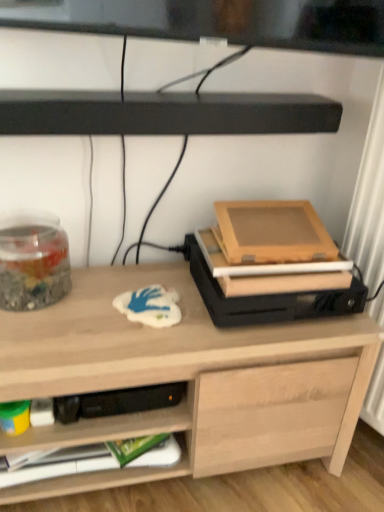
Question: Does light wood desk at center have a lesser width compared to black matte soundbar at upper center?

Choices:
 (A) no
 (B) yes

Answer: (A)

Question: Can you confirm if light wood desk at center is shorter than black matte soundbar at upper center?

Choices:
 (A) yes
 (B) no

Answer: (B)

Question: From a real-world perspective, is light wood desk at center beneath black matte soundbar at upper center?

Choices:
 (A) yes
 (B) no

Answer: (A)

Question: Is light wood desk at center at the left side of black matte soundbar at upper center?

Choices:
 (A) no
 (B) yes

Answer: (B)

Question: Considering the relative sizes of light wood desk at center and black matte soundbar at upper center in the image provided, is light wood desk at center smaller than black matte soundbar at upper center?

Choices:
 (A) no
 (B) yes

Answer: (A)

Question: From a real-world perspective, is transparent glass jar at left physically located above or below green matte paperback book at lower left?

Choices:
 (A) above
 (B) below

Answer: (A)

Question: In the image, is transparent glass jar at left on the left side or the right side of green matte paperback book at lower left?

Choices:
 (A) left
 (B) right

Answer: (A)

Question: From their relative heights in the image, would you say transparent glass jar at left is taller or shorter than green matte paperback book at lower left?

Choices:
 (A) short
 (B) tall

Answer: (B)

Question: Is transparent glass jar at left inside or outside of green matte paperback book at lower left?

Choices:
 (A) outside
 (B) inside

Answer: (A)

Question: In the image, is transparent glass jar at left positioned in front of or behind black matte soundbar at upper center?

Choices:
 (A) front
 (B) behind

Answer: (B)

Question: Based on their positions, is transparent glass jar at left located to the left or right of black matte soundbar at upper center?

Choices:
 (A) left
 (B) right

Answer: (A)

Question: From the image's perspective, is transparent glass jar at left positioned above or below black matte soundbar at upper center?

Choices:
 (A) below
 (B) above

Answer: (A)

Question: Based on their sizes in the image, would you say transparent glass jar at left is bigger or smaller than black matte soundbar at upper center?

Choices:
 (A) small
 (B) big

Answer: (A)

Question: From a real-world perspective, is black matte soundbar at upper center above or below transparent glass jar at left?

Choices:
 (A) above
 (B) below

Answer: (A)

Question: Is point (150, 111) closer or farther from the camera than point (24, 279)?

Choices:
 (A) closer
 (B) farther

Answer: (A)